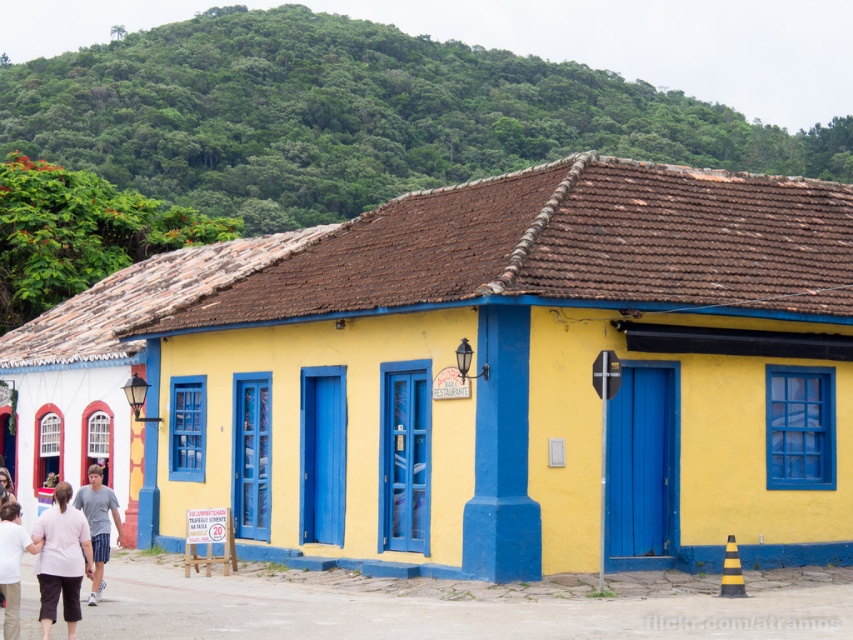
You are a tourist visiting this tropical building and want to take a photo that includes both the green leafy hillside at upper center and the gray cotton shirt at lower left. Which object should you focus on first to ensure both are in the frame?

You should focus on the green leafy hillside at upper center first because it is larger than the gray cotton shirt at lower left, so it will occupy more space in the photo and ensure both are visible.

You are a tailor who needs to determine which clothing item is shorter between the pink fabric pants at lower left and the gray cotton shirt at lower left. Based on the scene, which one is shorter?

The pink fabric pants at lower left has a lesser height compared to the gray cotton shirt at lower left, so the pink fabric pants at lower left is shorter.

You are standing at the entrance of the RESTAURANTE and want to reach the point marked at coordinates point (x=375, y=24). Considering your height is 5 feet 8 inches, will you be able to see the top of the building from that point?

The point 0.039, 0441 is 411.59 feet away from the viewer. Since the building has a terracotta tiled roof and is painted in bright yellow with blue trim, it is likely tall enough that the top would still be visible from that distance, assuming there are no obstructions. However, without specific height data, we can infer that at 411.59 feet away, the top should be visible as the building stands out against the green background.